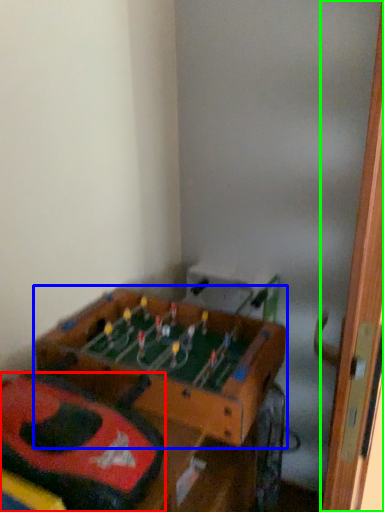
Question: Estimate the real-world distances between objects in this image. Which object is farther from kit (highlighted by a red box), table (highlighted by a blue box) or door (highlighted by a green box)?

Choices:
 (A) table
 (B) door

Answer: (B)